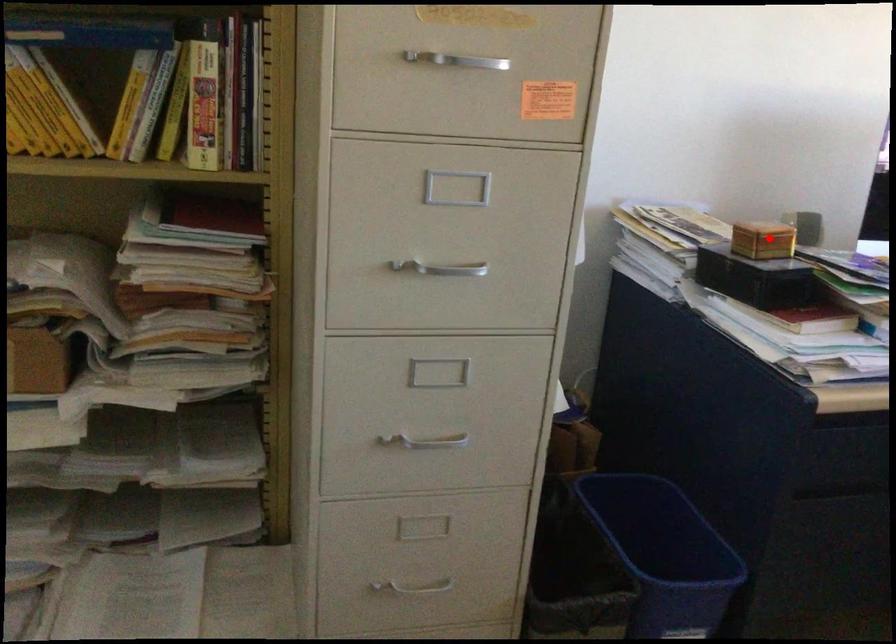
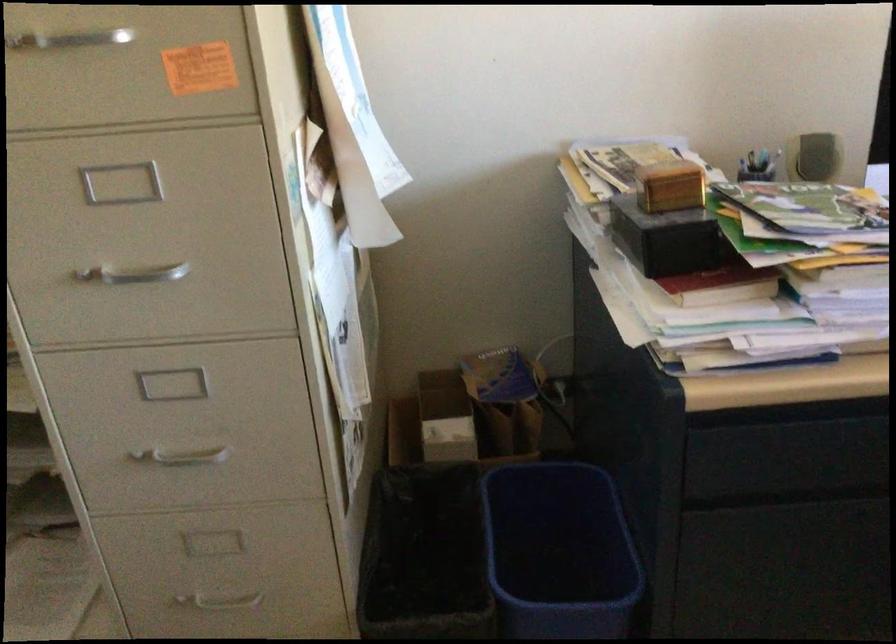
Find the pixel in the second image that matches the highlighted location in the first image.

(669, 185)